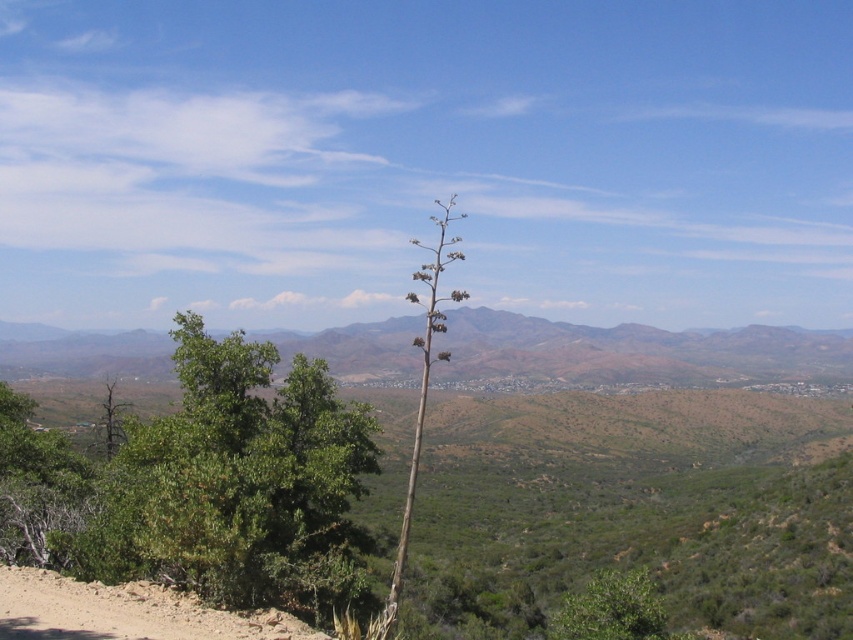
You are standing in the middle of the landscape and want to walk to the green leafy tree at lower right. Which direction should you head towards relative to the green woody at center?

The green leafy tree at lower right is to the right of the green woody at center, so you should head towards the right direction relative to the green woody at center to reach it.